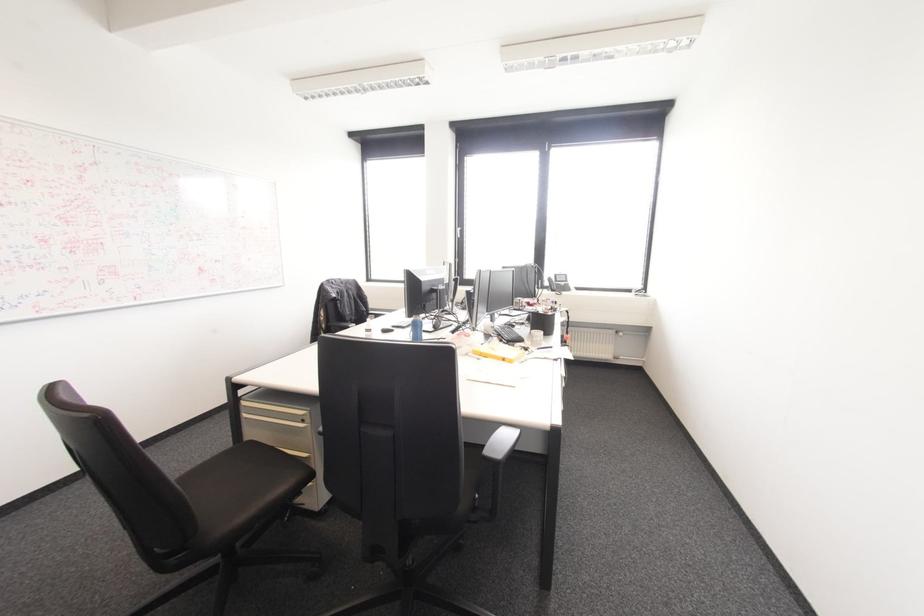
The height and width of the screenshot is (616, 924). In order to click on black chair armrest in this screenshot , I will do `click(501, 444)`.